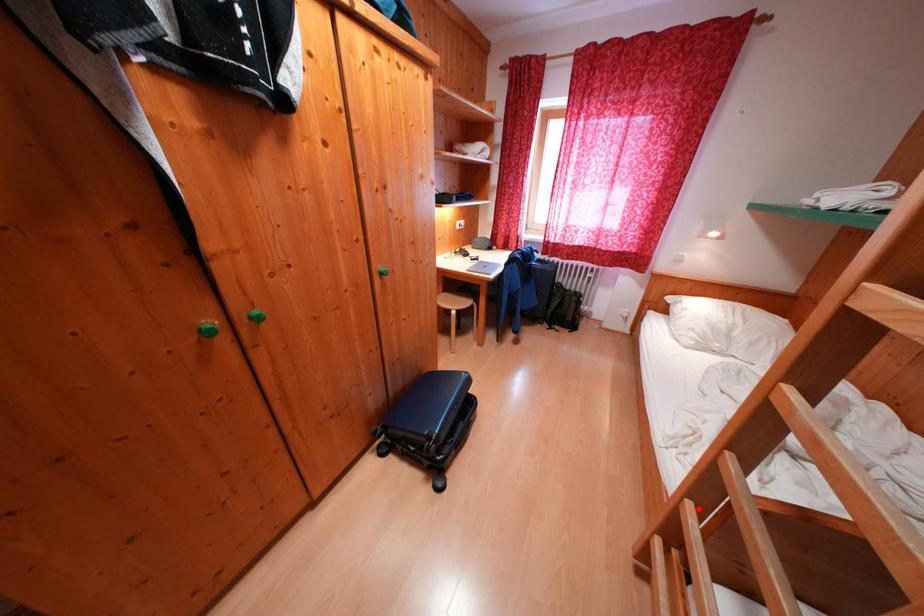
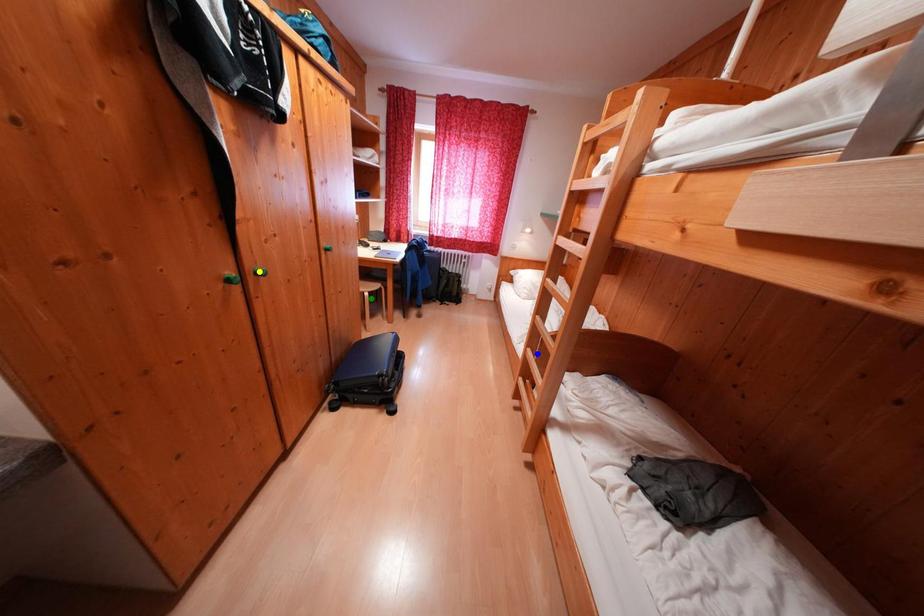
Question: I am providing you with two images of the same scene from different viewpoints. A red point is marked on the first image. You are given multiple points on the second image. Which spot in image 2 lines up with the point in image 1?

Choices:
 (A) blue point
 (B) green point
 (C) yellow point

Answer: (A)